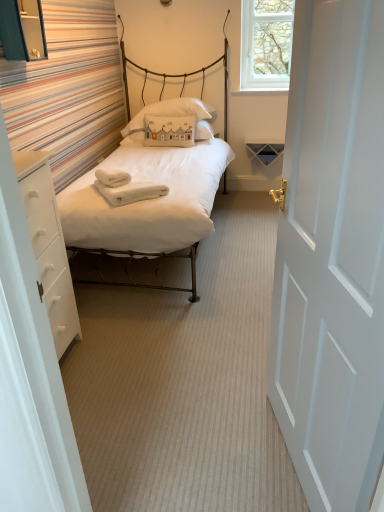
Locate an element on the screen. white painted wood door at right is located at coordinates (332, 256).

From the picture: What is the approximate width of white painted wood door at right?

5.19 inches.

What do you see at coordinates (112, 177) in the screenshot? The height and width of the screenshot is (512, 384). I see `white soft towels at center` at bounding box center [112, 177].

What do you see at coordinates (153, 182) in the screenshot?
I see `matte white bed at center` at bounding box center [153, 182].

This screenshot has height=512, width=384. In order to click on white matte drawer at left in this screenshot , I will do `click(48, 246)`.

The width and height of the screenshot is (384, 512). Describe the element at coordinates (266, 44) in the screenshot. I see `clear glass window at upper right` at that location.

Where is `white soft towel at center`? The height and width of the screenshot is (512, 384). white soft towel at center is located at coordinates (126, 187).

Is white fabric pillow at center not within clear glass window at upper right?

Yes, white fabric pillow at center is not within clear glass window at upper right.

How different are the orientations of white fabric pillow at center and clear glass window at upper right in degrees?

The angle between the facing direction of white fabric pillow at center and the facing direction of clear glass window at upper right is 0.0948 degrees.

Considering the sizes of objects white fabric pillow at center and clear glass window at upper right in the image provided, who is wider, white fabric pillow at center or clear glass window at upper right?

white fabric pillow at center is wider.

Identify the location of pillow that is on the left side of clear glass window at upper right. (170, 111).

Is clear glass window at upper right positioned behind matte white bed at center?

Yes, clear glass window at upper right is behind matte white bed at center.

Is clear glass window at upper right positioned far away from matte white bed at center?

Yes, clear glass window at upper right and matte white bed at center are located far from each other.

I want to click on window on the right of matte white bed at center, so click(266, 44).

From the image's perspective, is matte white bed at center on white painted wood door at right?

Correct, matte white bed at center appears higher than white painted wood door at right in the image.

Looking at the image, does matte white bed at center seem bigger or smaller compared to white painted wood door at right?

Considering their sizes, matte white bed at center takes up more space than white painted wood door at right.

Does matte white bed at center lie behind white painted wood door at right?

Yes, the depth of matte white bed at center is greater than that of white painted wood door at right.

Between matte white bed at center and white painted wood door at right, which one appears on the right side from the viewer's perspective?

white painted wood door at right is more to the right.

Who is taller, clear glass window at upper right or white matte drawer at left?

With more height is white matte drawer at left.

Is clear glass window at upper right behind white matte drawer at left?

Yes, it is behind white matte drawer at left.

Considering the relative positions of clear glass window at upper right and white matte drawer at left in the image provided, is clear glass window at upper right to the right of white matte drawer at left from the viewer's perspective?

Indeed, clear glass window at upper right is positioned on the right side of white matte drawer at left.

Is white fabric pillow at center not near white soft towels at center?

Yes, white fabric pillow at center and white soft towels at center are quite far apart.

In the scene shown: Is white fabric pillow at center inside the boundaries of white soft towels at center, or outside?

white fabric pillow at center is not enclosed by white soft towels at center.

Looking at this image, does white fabric pillow at center come in front of white soft towels at center?

No, white fabric pillow at center is behind white soft towels at center.

Considering the relative sizes of white fabric pillow at center and white soft towels at center in the image provided, is white fabric pillow at center shorter than white soft towels at center?

In fact, white fabric pillow at center may be taller than white soft towels at center.

How far apart are white soft towel at center and matte white bed at center?

17.15 inches.

At what (x,y) coordinates should I click in order to perform the action: click on bed located above the white soft towel at center (from a real-world perspective). Please return your answer as a coordinate pair (x, y). The image size is (384, 512). Looking at the image, I should click on (153, 182).

Considering the relative sizes of white soft towel at center and matte white bed at center in the image provided, is white soft towel at center taller than matte white bed at center?

No, white soft towel at center is not taller than matte white bed at center.

Would you say white soft towel at center is outside matte white bed at center?

Actually, white soft towel at center is within matte white bed at center.

Based on their positions, is matte white bed at center located to the left or right of white fabric pillow at center?

Based on their positions, matte white bed at center is located to the left of white fabric pillow at center.

How different are the orientations of matte white bed at center and white fabric pillow at center in degrees?

matte white bed at center and white fabric pillow at center are facing 0.00241 degrees away from each other.

Looking at this image, between matte white bed at center and white fabric pillow at center, which one has less height?

With less height is white fabric pillow at center.

Between matte white bed at center and white fabric pillow at center, which one has larger width?

matte white bed at center.

Locate an element on the screen. pillow located below the clear glass window at upper right (from the image's perspective) is located at coordinates (170, 111).

Locate an element on the screen. window above the matte white bed at center (from the image's perspective) is located at coordinates (266, 44).

Estimate the real-world distances between objects in this image. Which object is closer to white soft towels at center, white matte drawer at left or white soft towel at center?

white soft towel at center is positioned closer to the anchor white soft towels at center.

From the image, which object appears to be farther from white painted wood door at right, clear glass window at upper right or white fabric pillow at center?

Based on the image, clear glass window at upper right appears to be further to white painted wood door at right.

Based on their spatial positions, is matte white bed at center or white fabric pillow at center closer to white soft towels at center?

The object closer to white soft towels at center is matte white bed at center.

Estimate the real-world distances between objects in this image. Which object is closer to white soft towels at center, matte white bed at center or white matte drawer at left?

matte white bed at center lies closer to white soft towels at center than the other object.

Estimate the real-world distances between objects in this image. Which object is closer to matte white bed at center, white fabric pillow at center or clear glass window at upper right?

The object closer to matte white bed at center is white fabric pillow at center.

Looking at the image, which one is located closer to white soft towel at center, white fabric pillow at center or white soft towels at center?

white soft towels at center lies closer to white soft towel at center than the other object.

When comparing their distances from white soft towel at center, does white fabric pillow at center or white matte drawer at left seem closer?

white matte drawer at left is closer to white soft towel at center.

Considering their positions, is white soft towel at center positioned closer to white matte drawer at left than white fabric pillow at center?

The object closer to white matte drawer at left is white soft towel at center.

The height and width of the screenshot is (512, 384). I want to click on nightstand between white painted wood door at right and clear glass window at upper right in the front-back direction, so click(x=48, y=246).

At what (x,y) coordinates should I click in order to perform the action: click on blanket between white painted wood door at right and white fabric pillow at center along the z-axis. Please return your answer as a coordinate pair (x, y). Looking at the image, I should click on (126, 187).

Where is `blanket between matte white bed at center and clear glass window at upper right along the z-axis`? The width and height of the screenshot is (384, 512). blanket between matte white bed at center and clear glass window at upper right along the z-axis is located at coordinates (126, 187).

This screenshot has width=384, height=512. What are the coordinates of `blanket located between matte white bed at center and white fabric pillow at center in the depth direction` in the screenshot? It's located at (126, 187).